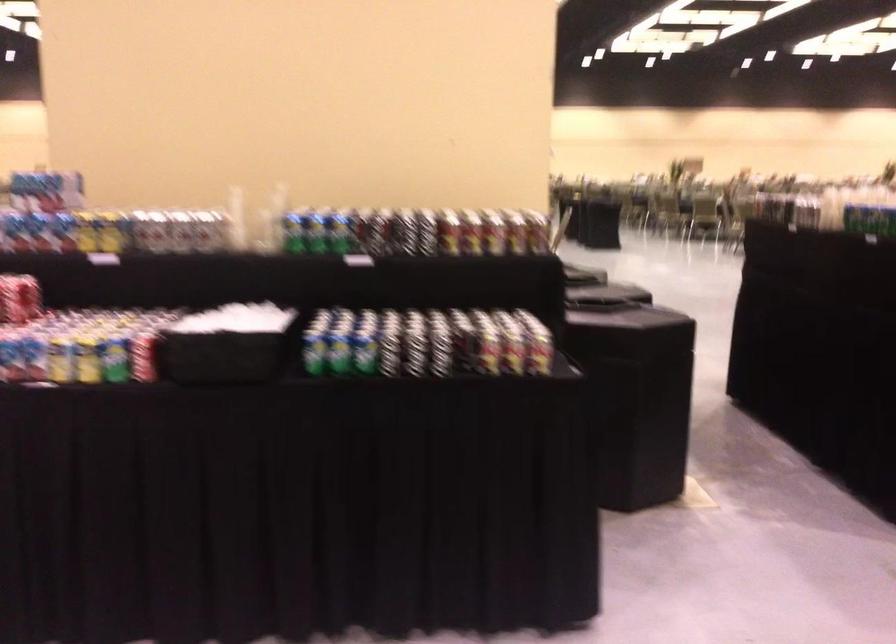
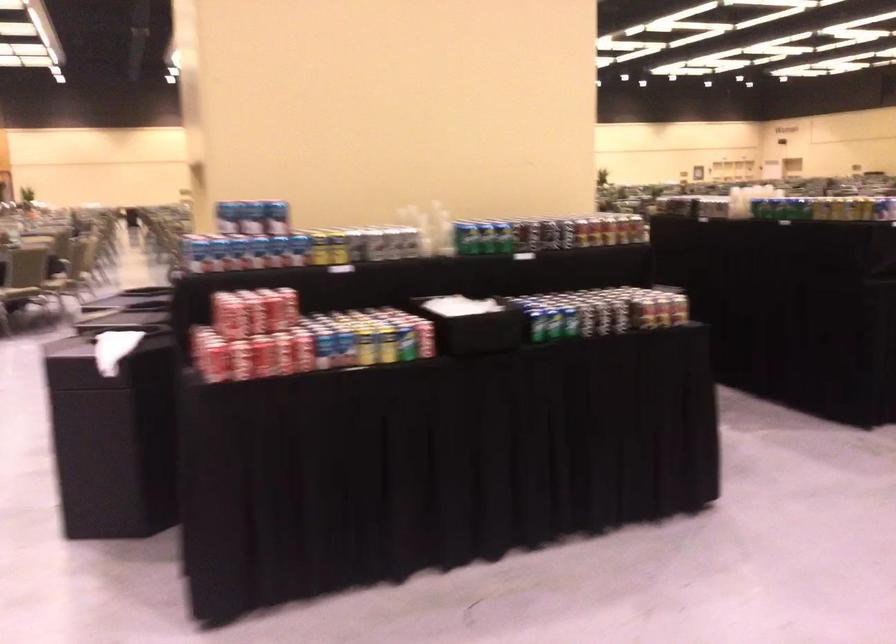
Find the pixel in the second image that matches (194,230) in the first image.

(395, 242)